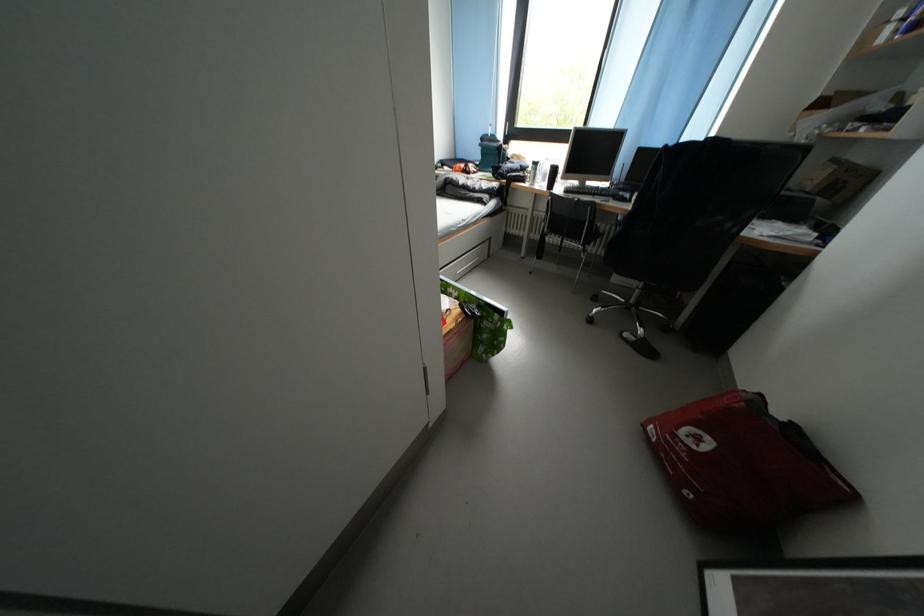
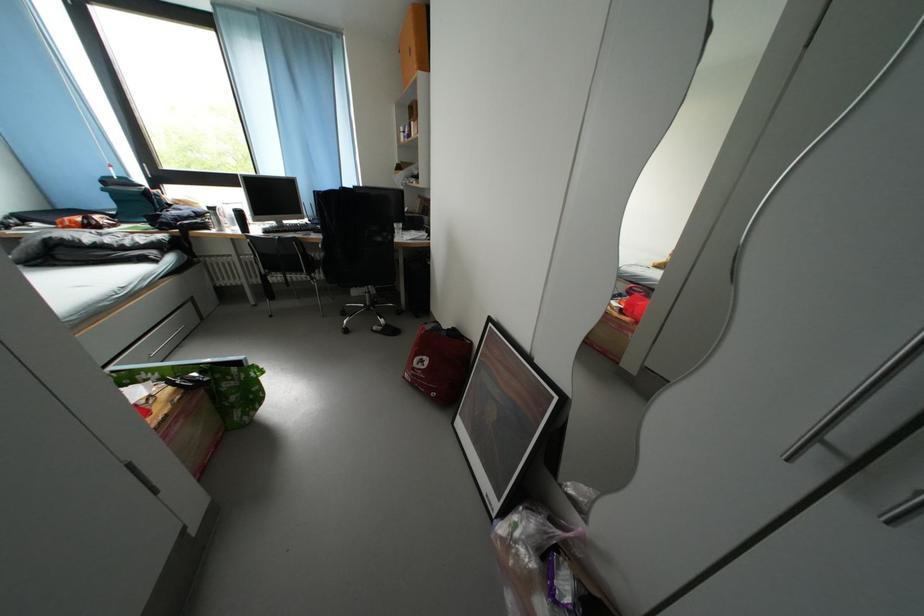
The point at (553, 195) is marked in the first image. Where is the corresponding point in the second image?

(248, 238)